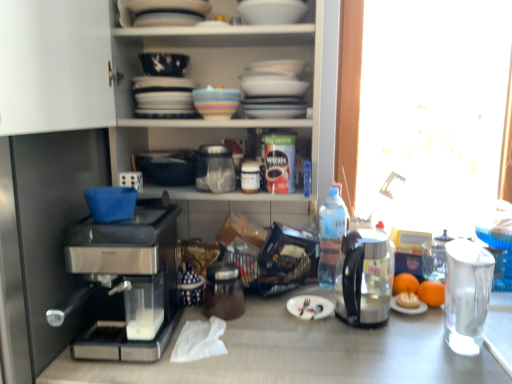
Question: Is shiny metallic coffee maker at center, the second appliance in the top-to-bottom sequence, bigger or smaller than silver metallic fork at center?

Choices:
 (A) big
 (B) small

Answer: (A)

Question: Is shiny metallic coffee maker at center, the 1th appliance from the bottom, wider or thinner than silver metallic fork at center?

Choices:
 (A) thin
 (B) wide

Answer: (B)

Question: Which object is positioned farthest from the matte black bowl at upper center?

Choices:
 (A) transparent glass jar at center, placed as the 2th appliance when sorted from bottom to top
 (B) sleek metallic coffee maker at left
 (C) transparent glass coffee pot at right
 (D) silver metallic fork at center
 (E) white matte paper plate at center

Answer: (D)

Question: Considering the real-world distances, which object is farthest from the shiny metallic coffee maker at center, the 1th appliance from the bottom?

Choices:
 (A) orange matte at right, arranged as the 1th orange when viewed from the right
 (B) multicolored ceramic bowl at center, placed as the first tableware when sorted from bottom to top
 (C) orange matte at right, placed as the 2th orange when sorted from right to left
 (D) orange matte fruit at right
 (E) white matte paper plate at center

Answer: (A)